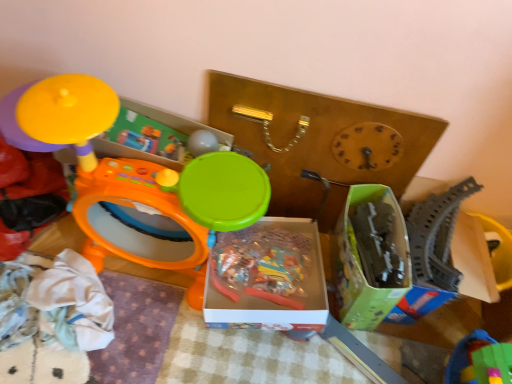
Locate an element on the screen. vacant area that lies in front of translucent plastic box at center, the 2th storage box in the right-to-left sequence is located at coordinates (238, 360).